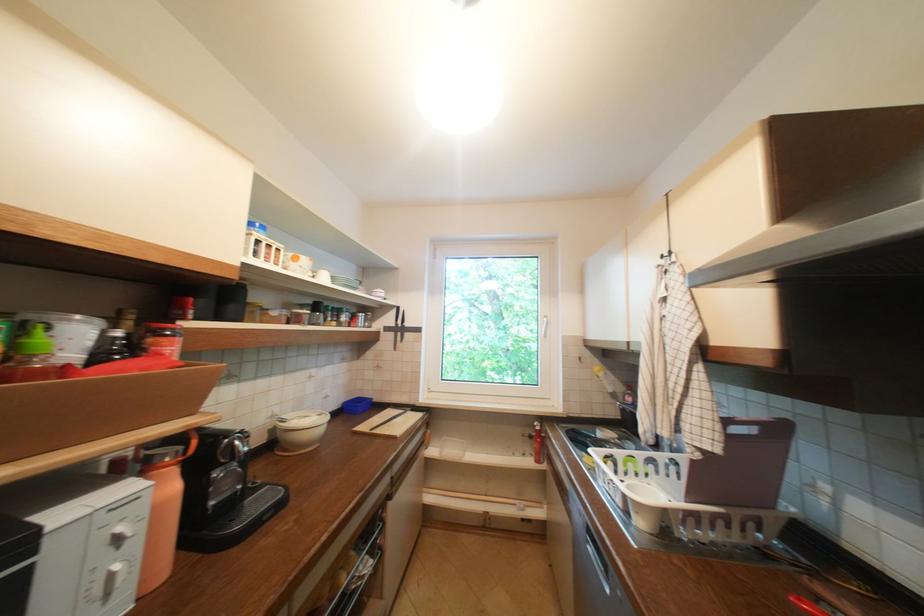
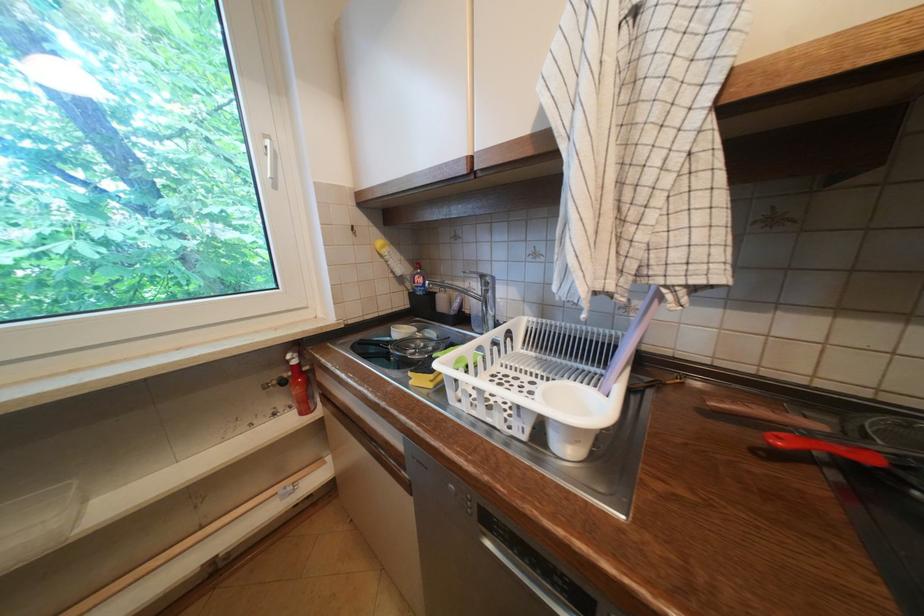
Locate, in the second image, the point that corresponds to [542,427] in the first image.

(296, 362)